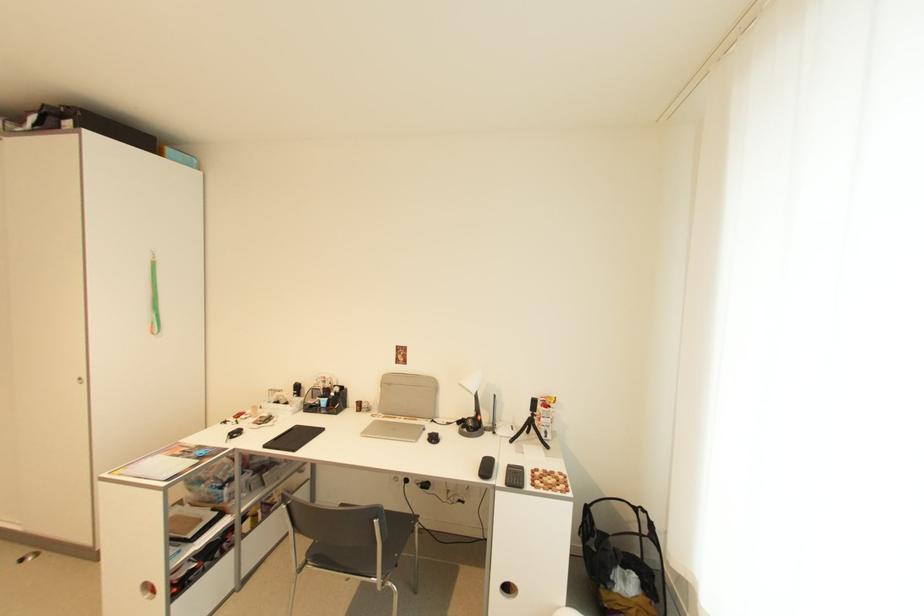
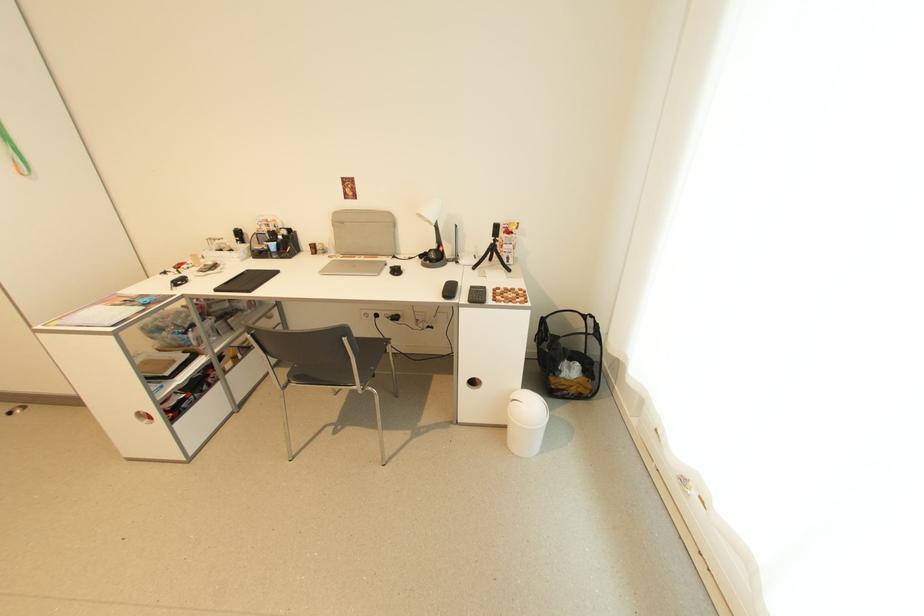
In the second image, find the point that corresponds to the point at 536,411 in the first image.

(497, 238)